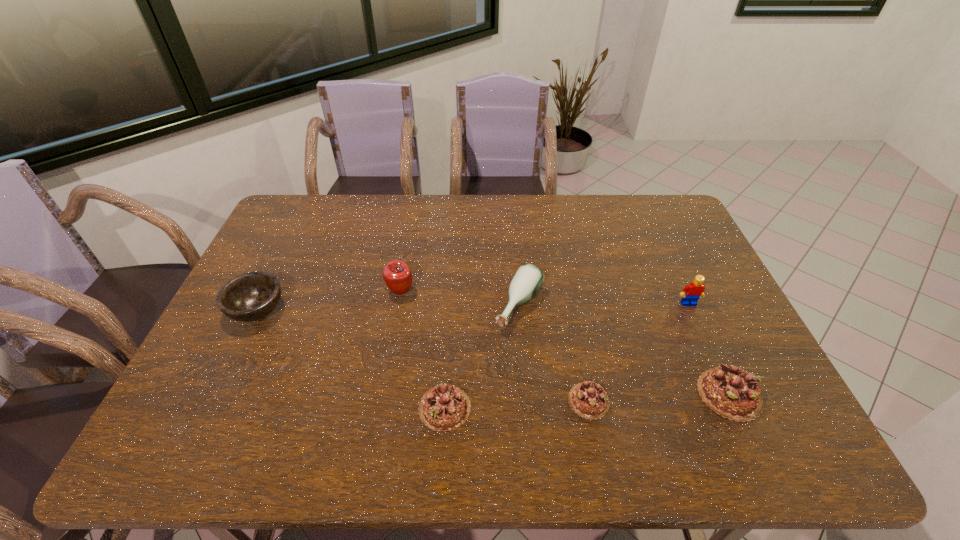
Identify the location of vacant region between the sixth object from right to left and the Lego. This screenshot has width=960, height=540. (544, 298).

You are a GUI agent. You are given a task and a screenshot of the screen. Output one action in this format:
    pyautogui.click(x=<x>, y=<y>)
    Task: Click on the unoccupied position between the shortest chocolate cake and the rightmost chocolate cake
    The height and width of the screenshot is (540, 960).
    Given the screenshot: What is the action you would take?
    pyautogui.click(x=659, y=397)

Identify the location of empty location between the shortest object and the second object from left to right. (494, 346).

Where is `vacant region between the sixth object from right to left and the fourth object from right to left`? vacant region between the sixth object from right to left and the fourth object from right to left is located at coordinates (460, 299).

Point out which object is positioned as the sixth nearest to the Lego. Please provide its 2D coordinates. Your answer should be formatted as a tuple, i.e. [(x, y)], where the tuple contains the x and y coordinates of a point satisfying the conditions above.

[(251, 296)]

Select which object is the sixth closest to the apple. Please provide its 2D coordinates. Your answer should be formatted as a tuple, i.e. [(x, y)], where the tuple contains the x and y coordinates of a point satisfying the conditions above.

[(691, 293)]

What are the coordinates of `chocolate cake object that ranks as the closest to the bottle` in the screenshot? It's located at (589, 400).

You are a GUI agent. You are given a task and a screenshot of the screen. Output one action in this format:
    pyautogui.click(x=<x>, y=<y>)
    Task: Click on the second closest chocolate cake to the second shortest object
    The height and width of the screenshot is (540, 960).
    Given the screenshot: What is the action you would take?
    pyautogui.click(x=731, y=392)

At what (x,y) coordinates should I click in order to perform the action: click on vacant space that satisfies the following two spatial constraints: 1. on the front side of the apple; 2. on the right side of the rightmost chocolate cake. Please return your answer as a coordinate pair (x, y). The width and height of the screenshot is (960, 540). Looking at the image, I should click on (382, 394).